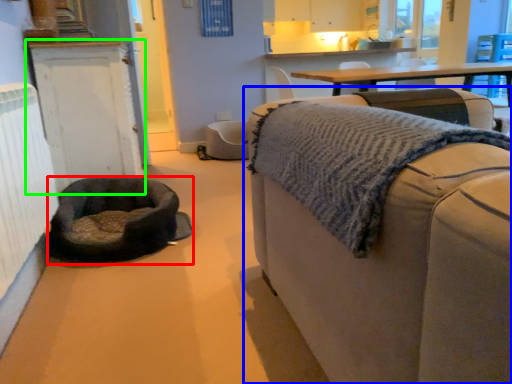
Question: Which object is the farthest from dog bed (highlighted by a red box)? Choose among these: studio couch (highlighted by a blue box) or cabinetry (highlighted by a green box).

Choices:
 (A) studio couch
 (B) cabinetry

Answer: (A)